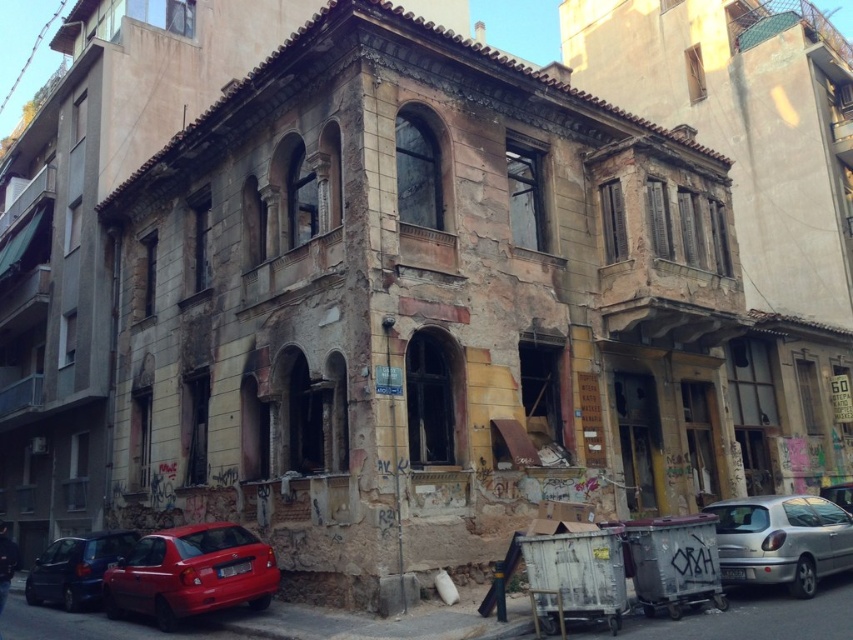
Question: Can you confirm if shiny red hatchback at lower left is bigger than matte red car at lower left?

Choices:
 (A) no
 (B) yes

Answer: (B)

Question: Is shiny red hatchback at lower left below matte red car at lower left?

Choices:
 (A) yes
 (B) no

Answer: (B)

Question: Which object is farther from the camera taking this photo?

Choices:
 (A) shiny red hatchback at lower left
 (B) matte red car at lower left
 (C) silver metallic car at lower right

Answer: (B)

Question: Can you confirm if shiny red hatchback at lower left is smaller than silver metallic car at lower right?

Choices:
 (A) no
 (B) yes

Answer: (A)

Question: Considering the real-world distances, which object is closest to the matte red car at lower left?

Choices:
 (A) shiny red hatchback at lower left
 (B) silver metallic car at lower right

Answer: (A)

Question: Which point is farther to the camera?

Choices:
 (A) matte red car at lower left
 (B) silver metallic car at lower right
 (C) shiny red hatchback at lower left

Answer: (A)